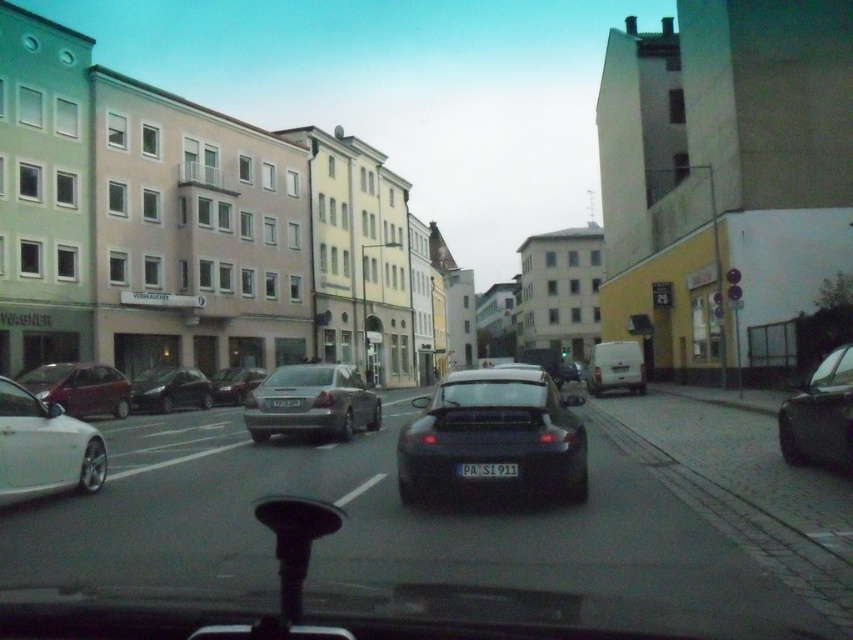
Is point (22, 445) farther from camera compared to point (190, 401)?

No, it is not.

Which of these two, shiny white car at left or shiny black sedan at center-left, stands shorter?

shiny white car at left is shorter.

Describe the element at coordinates (44, 448) in the screenshot. The image size is (853, 640). I see `shiny white car at left` at that location.

At what (x,y) coordinates should I click in order to perform the action: click on shiny white car at left. Please return your answer as a coordinate pair (x, y). Looking at the image, I should click on pyautogui.click(x=44, y=448).

Which is in front, point (338, 436) or point (469, 465)?

Point (469, 465) is in front.

Is satin silver sedan at center taller than white plastic license plate at center?

Correct, satin silver sedan at center is much taller as white plastic license plate at center.

Locate an element on the screen. This screenshot has width=853, height=640. satin silver sedan at center is located at coordinates tap(312, 403).

Image resolution: width=853 pixels, height=640 pixels. I want to click on shiny black car at right, so click(x=820, y=413).

This screenshot has height=640, width=853. What do you see at coordinates (820, 413) in the screenshot?
I see `shiny black car at right` at bounding box center [820, 413].

I want to click on shiny black car at right, so click(820, 413).